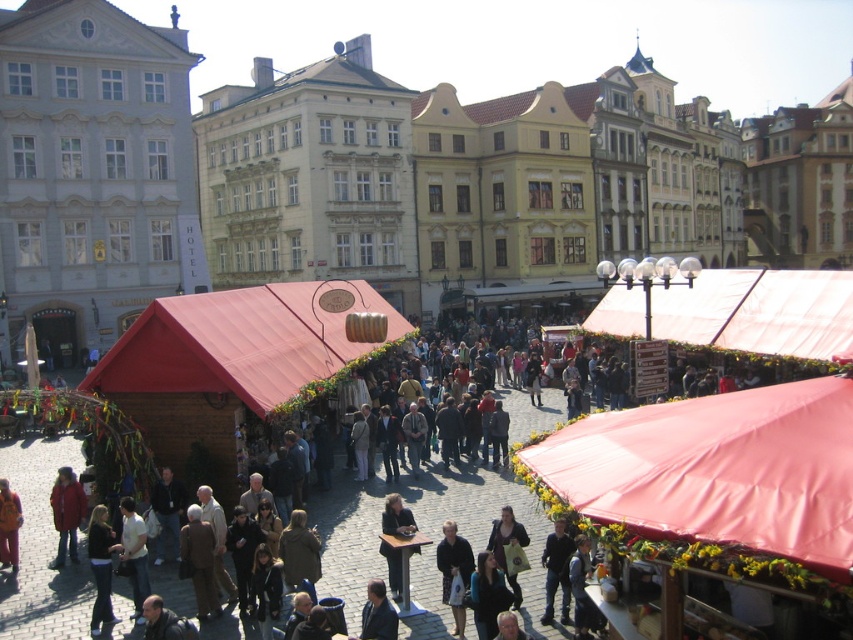
You are a customer at the market and want to buy a pair of dark blue jeans at center. The vendor is under the matte red canopy at center right. Can you walk directly under the canopy to purchase them?

The matte red canopy at center right is positioned over dark blue jeans at center, so yes, you can walk directly under the canopy to purchase the dark blue jeans at center because the canopy covers that area.

You are a customer at the market and want to see both the red wool coat at lower left and the brown leather jacket at lower left. Which item is closer to you?

The red wool coat at lower left is closer to you because the brown leather jacket at lower left is behind it.